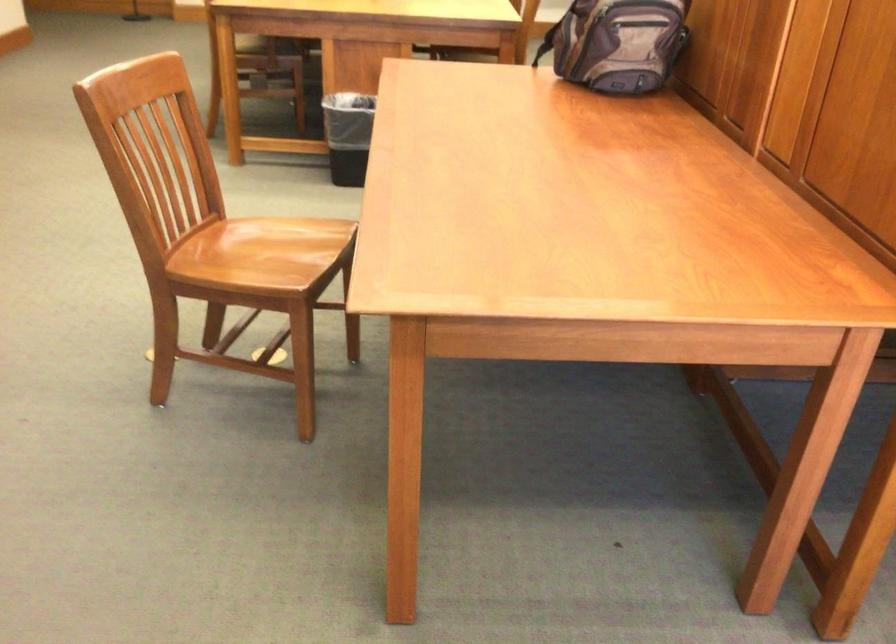
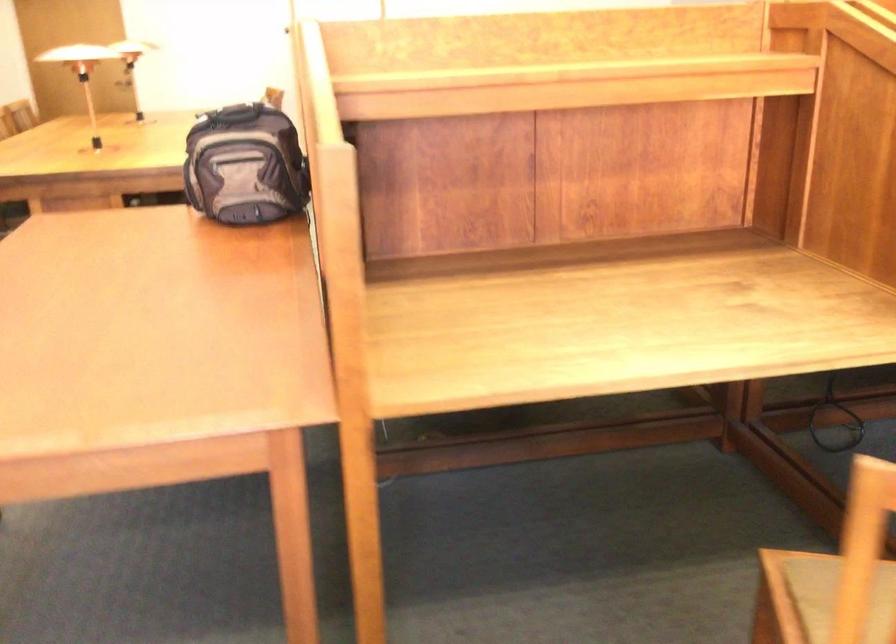
Question: The camera is either moving clockwise (left) or counter-clockwise (right) around the object. The first image is from the beginning of the video and the second image is from the end. Is the camera moving left or right when shooting the video?

Choices:
 (A) Left
 (B) Right

Answer: (A)